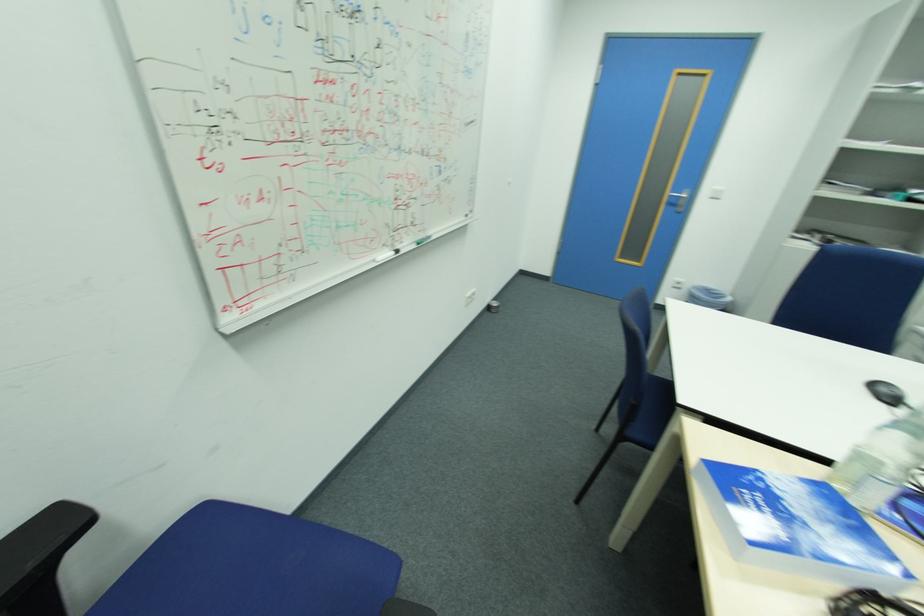
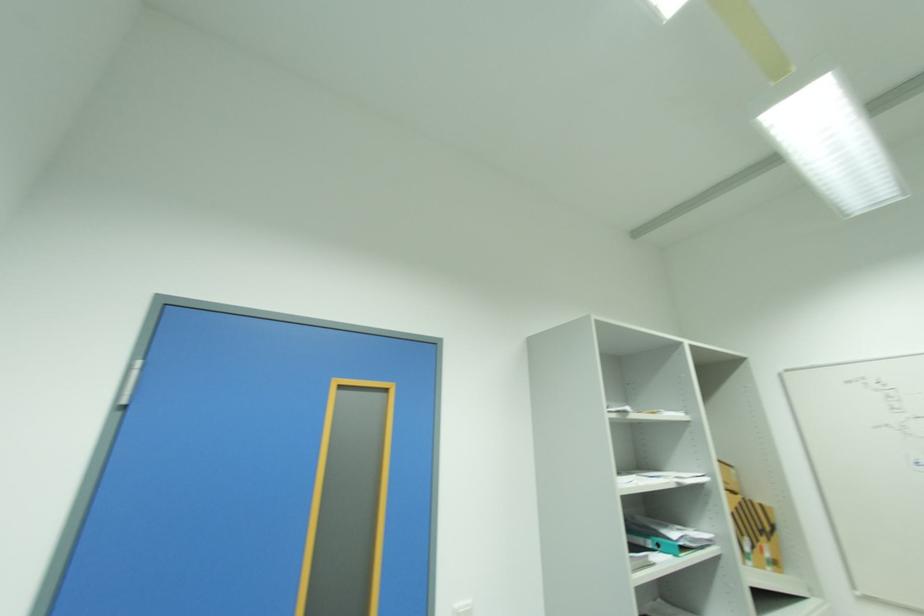
The point at (x=723, y=188) is marked in the first image. Where is the corresponding point in the second image?

(463, 604)